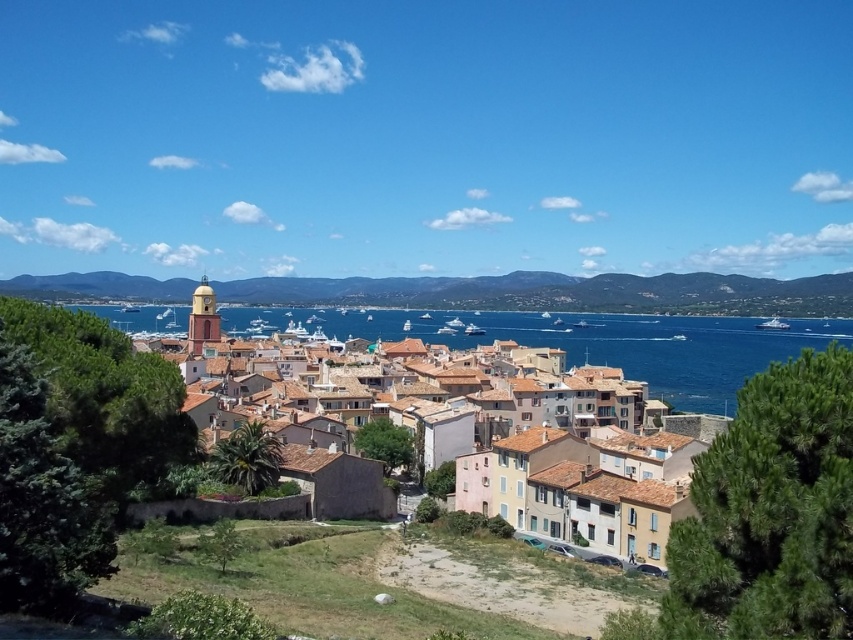
You are a photographer planning to capture the entire scene of the coastal town with your camera. Your camera has a limited field of view and can only focus on either the blue water at center or the metallic silver boat at right. Based on their sizes in the image, which object should you prioritize to ensure it fits entirely within the frame?

The blue water at center has a larger width than the metallic silver boat at right, so you should prioritize capturing the blue water at center to ensure it fits entirely within the frame.

You are standing at the top of the green grassy hillside at center and want to walk down to the multicolored tiled roofs at center. Which direction should you head to reach them?

You should head to the left since the green grassy hillside at center is positioned on the right side of the multicolored tiled roofs at center, so moving left would lead you towards them.

You are standing at the point marked as point (x=625, y=346) in the image. Based on the scene description, what is the immediate environment around you?

The point (x=625, y=346) is on blue water at center, so you are surrounded by the vibrant blue sea in the middle of the coastal town.